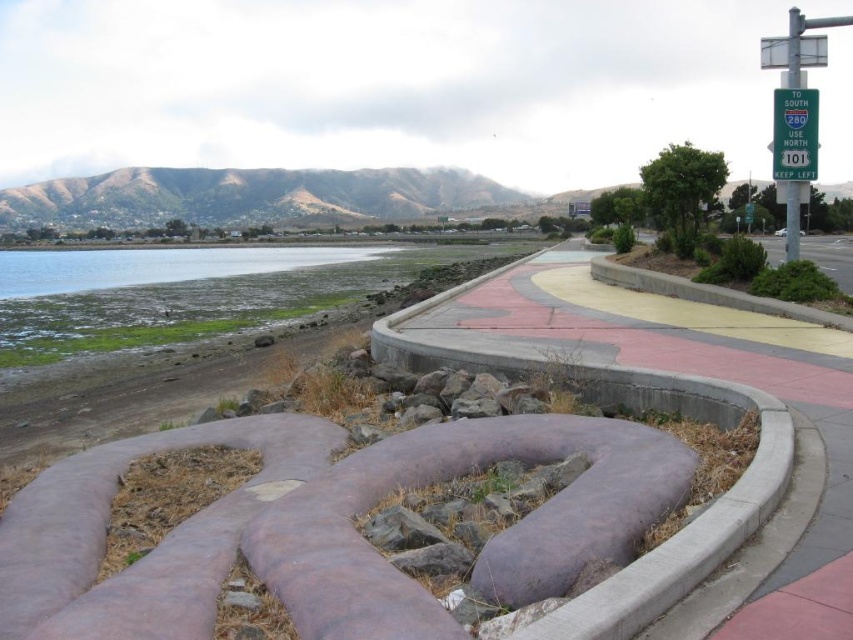
Who is higher up, purple rubber path at center or clear water at lower left?

clear water at lower left

Is purple rubber path at center positioned in front of clear water at lower left?

That is True.

Is point (799, 352) closer to viewer compared to point (90, 269)?

Yes, point (799, 352) is closer to viewer.

Find the location of a particular element. purple rubber path at center is located at coordinates (706, 376).

Does clear water at lower left appear over green plastic sign at upper right?

Correct, clear water at lower left is located above green plastic sign at upper right.

Which of these two, clear water at lower left or green plastic sign at upper right, stands taller?

clear water at lower left is taller.

Identify the location of clear water at lower left. The height and width of the screenshot is (640, 853). (157, 266).

Which is above, purple matte sculpture at center or clear water at lower left?

clear water at lower left

Can you confirm if purple matte sculpture at center is positioned below clear water at lower left?

Yes.

You are a GUI agent. You are given a task and a screenshot of the screen. Output one action in this format:
    pyautogui.click(x=<x>, y=<y>)
    Task: Click on the purple matte sculpture at center
    Image resolution: width=853 pixels, height=640 pixels.
    Given the screenshot: What is the action you would take?
    pyautogui.click(x=322, y=528)